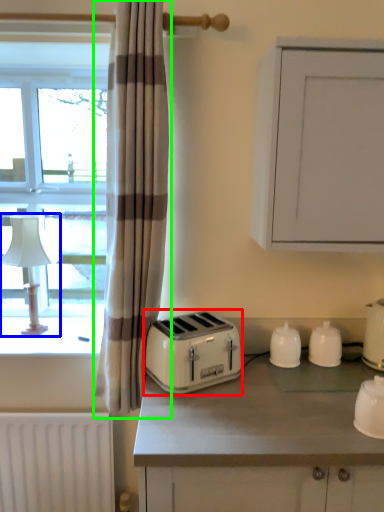
Question: Which object is the closest to the toaster (highlighted by a red box)? Choose among these: table lamp (highlighted by a blue box) or curtain (highlighted by a green box).

Choices:
 (A) table lamp
 (B) curtain

Answer: (B)